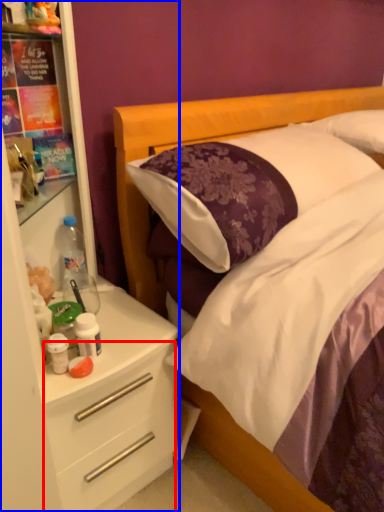
Question: Which of the following is the farthest to the observer, drawer (highlighted by a red box) or dresser (highlighted by a blue box)?

Choices:
 (A) drawer
 (B) dresser

Answer: (A)